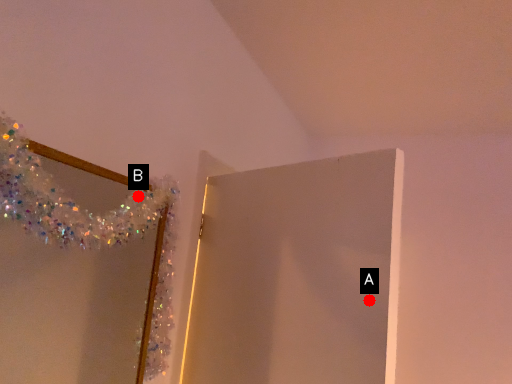
Question: Two points are circled on the image, labeled by A and B beside each circle. Which point appears closest to the camera in this image?

Choices:
 (A) A is closer
 (B) B is closer

Answer: (A)